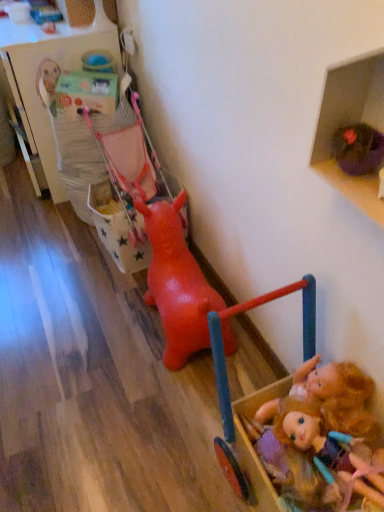
This screenshot has width=384, height=512. In order to click on vacant area that is in front of rubber dog at center, which appears as the 1th toy when viewed from the back in this screenshot , I will do `click(134, 411)`.